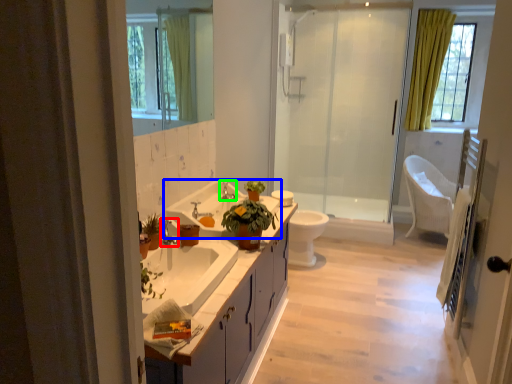
Question: Which object is positioned closest to faucet (highlighted by a red box)? Select from sink (highlighted by a blue box) and tap (highlighted by a green box).

Choices:
 (A) sink
 (B) tap

Answer: (A)